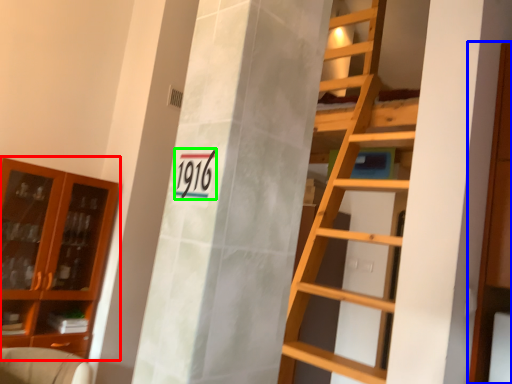
Question: Estimate the real-world distances between objects in this image. Which object is farther from cabinetry (highlighted by a red box), cabinetry (highlighted by a blue box) or number (highlighted by a green box)?

Choices:
 (A) cabinetry
 (B) number

Answer: (B)